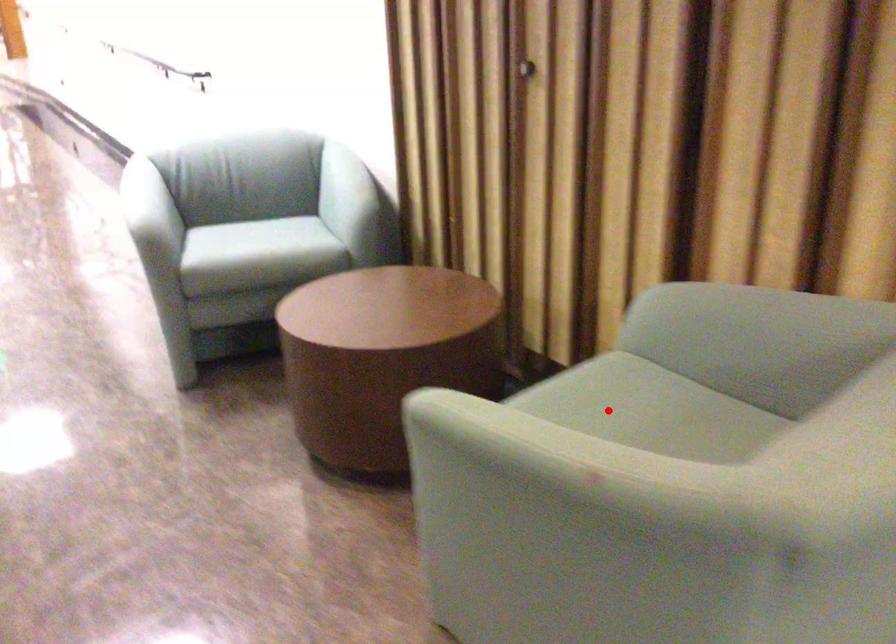
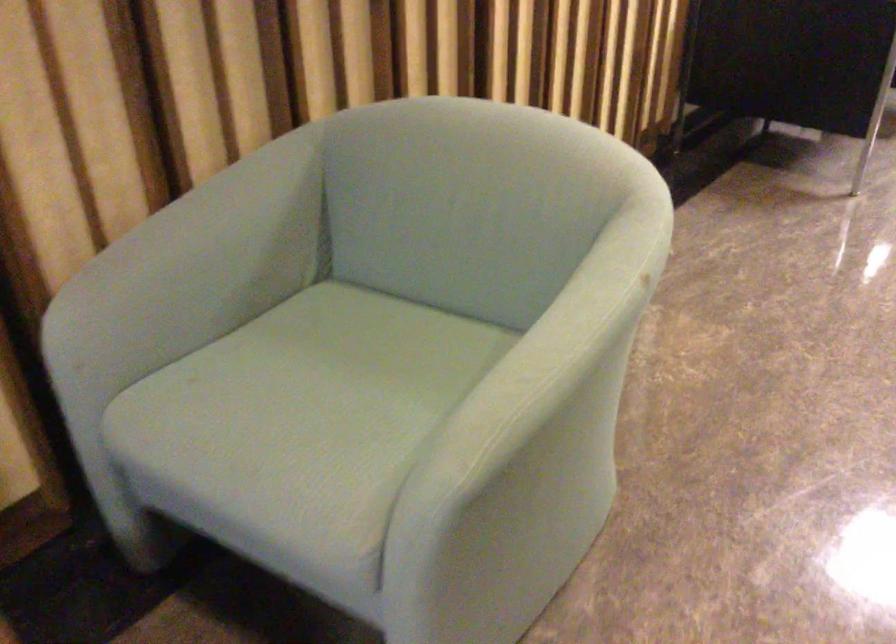
In the second image, find the point that corresponds to the highlighted location in the first image.

(305, 398)